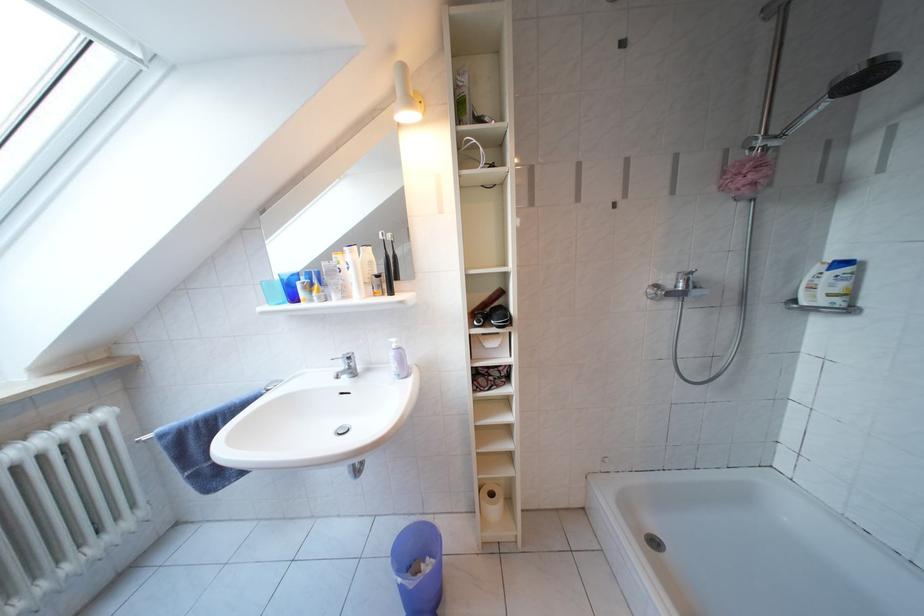
You are a GUI agent. You are given a task and a screenshot of the screen. Output one action in this format:
    pyautogui.click(x=<x>, y=<y>)
    Task: Click on the white tube
    
    Given the screenshot: What is the action you would take?
    pyautogui.click(x=64, y=505)